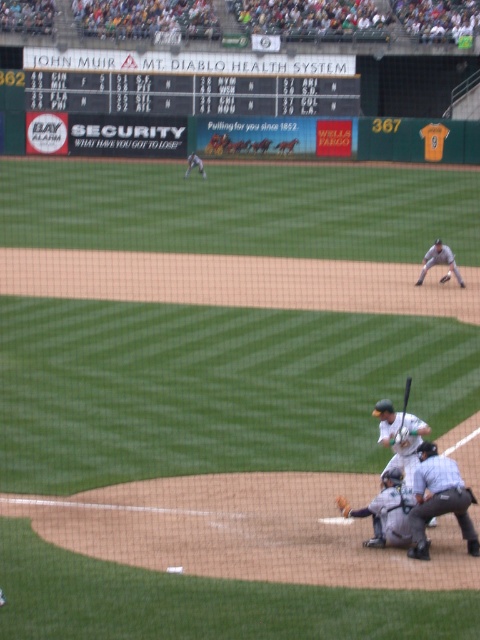
Between white matte baseball bat at lower center and brown leather glove at lower center, which one appears on the left side from the viewer's perspective?

white matte baseball bat at lower center

Is the position of white matte baseball bat at lower center more distant than that of brown leather glove at lower center?

No.

Between point (404, 428) and point (442, 276), which one is positioned behind?

Positioned behind is point (442, 276).

Identify the location of white matte baseball bat at lower center. (399, 436).

Does gray uniformed umpire at lower right appear over wooden bat at lower center?

Actually, gray uniformed umpire at lower right is below wooden bat at lower center.

Does gray uniformed umpire at lower right have a smaller size compared to wooden bat at lower center?

Indeed, gray uniformed umpire at lower right has a smaller size compared to wooden bat at lower center.

Where is `gray uniformed umpire at lower right`? gray uniformed umpire at lower right is located at coordinates (439, 499).

In the scene shown: Between gray uniformed umpire at lower right and gray uniform glove at right, which one appears on the left side from the viewer's perspective?

gray uniformed umpire at lower right

Who is more forward, [448,504] or [434,262]?

Point [448,504]

Find the location of a particular element. gray uniformed umpire at lower right is located at coordinates (439, 499).